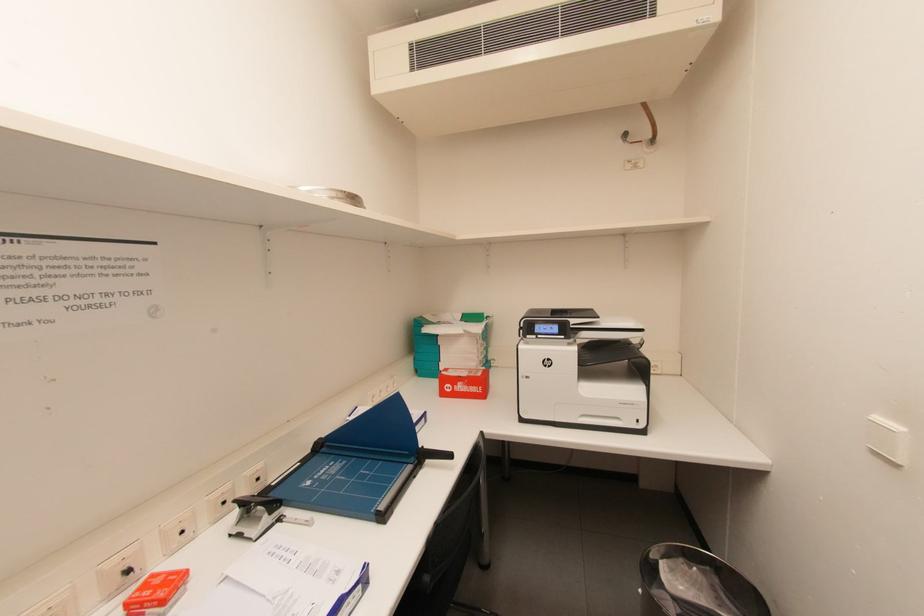
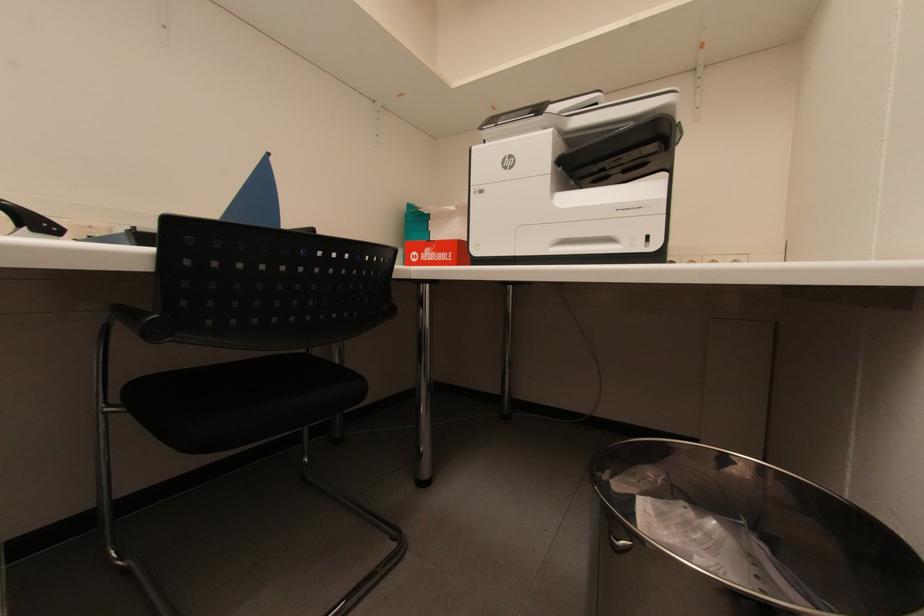
Question: Based on the continuous images, in which direction is the camera rotating? Reply with the corresponding letter.

Choices:
 (A) Left
 (B) Right
 (C) Up
 (D) Down

Answer: (A)